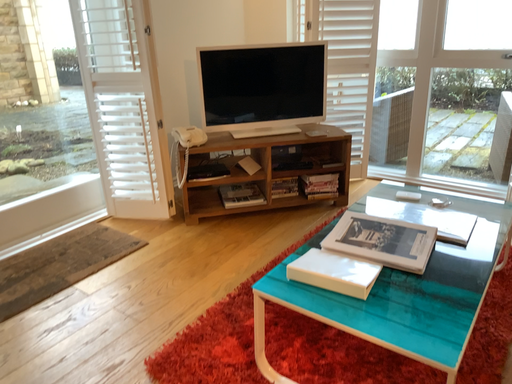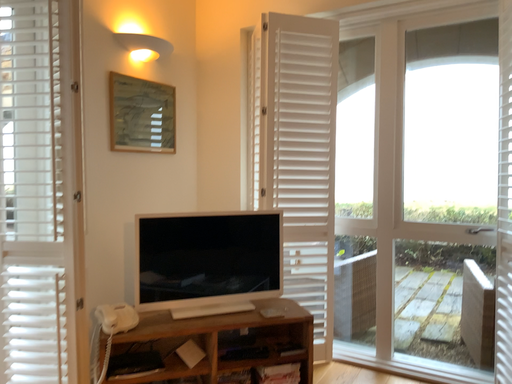
Question: Which way did the camera rotate in the video?

Choices:
 (A) rotated upward
 (B) rotated downward

Answer: (A)